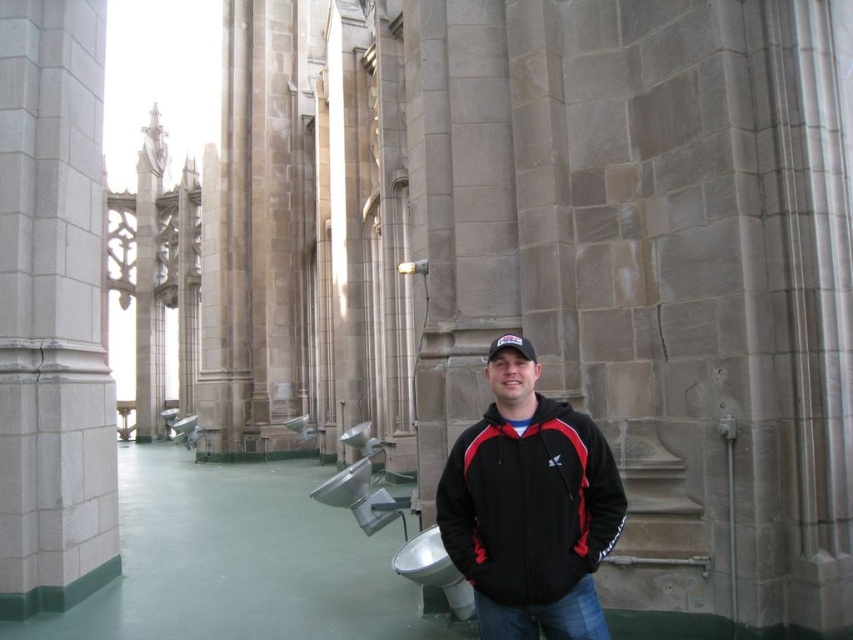
Question: Which of the following is the farthest from the observer?

Choices:
 (A) black fleece jacket at center
 (B) gray stone pillar at left

Answer: (B)

Question: Does gray stone pillar at left have a lesser width compared to black fleece jacket at center?

Choices:
 (A) no
 (B) yes

Answer: (B)

Question: Which point appears farthest from the camera in this image?

Choices:
 (A) (543, 570)
 (B) (97, 486)

Answer: (B)

Question: Can you confirm if gray stone pillar at left is positioned below black fleece jacket at center?

Choices:
 (A) no
 (B) yes

Answer: (A)

Question: Observing the image, what is the correct spatial positioning of gray stone pillar at left in reference to black fleece jacket at center?

Choices:
 (A) above
 (B) below

Answer: (A)